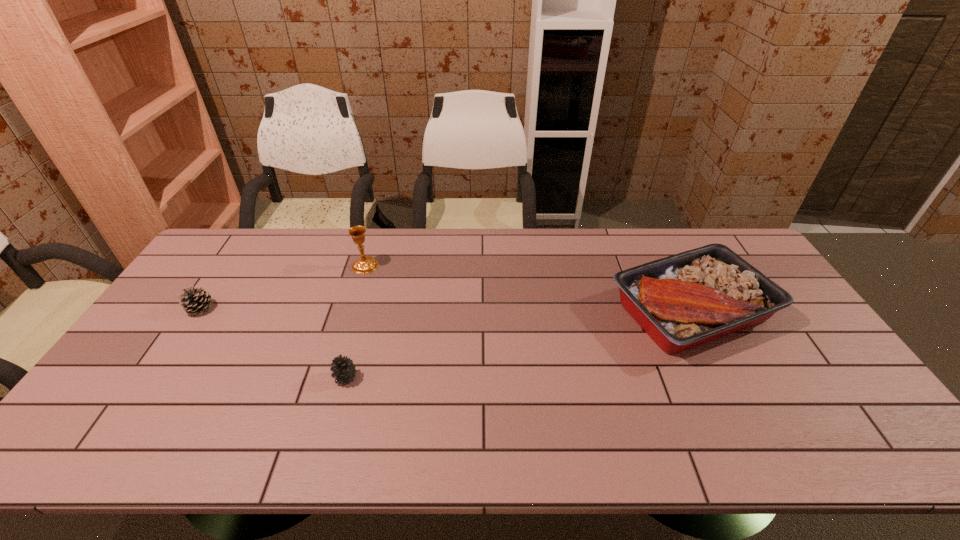
Image resolution: width=960 pixels, height=540 pixels. Identify the location of chalice. (367, 264).

Identify the location of the rightmost object. This screenshot has height=540, width=960. (681, 301).

The height and width of the screenshot is (540, 960). Find the location of `the second tallest object`. the second tallest object is located at coordinates (681, 301).

Identify the location of the leftmost object. The image size is (960, 540). (194, 300).

Locate an element on the screen. The height and width of the screenshot is (540, 960). the left pinecone is located at coordinates (194, 300).

Where is `the right pinecone`? This screenshot has height=540, width=960. the right pinecone is located at coordinates (343, 368).

Where is `the nearer pinecone`? This screenshot has height=540, width=960. the nearer pinecone is located at coordinates (343, 368).

Identify the location of free space located 0.250m on the right of the chalice. (453, 266).

Locate an element on the screen. vacant space located 0.180m on the back of the third shortest object is located at coordinates (653, 237).

This screenshot has height=540, width=960. Find the location of `vacant space located 0.250m on the right of the farther pinecone`. vacant space located 0.250m on the right of the farther pinecone is located at coordinates (298, 308).